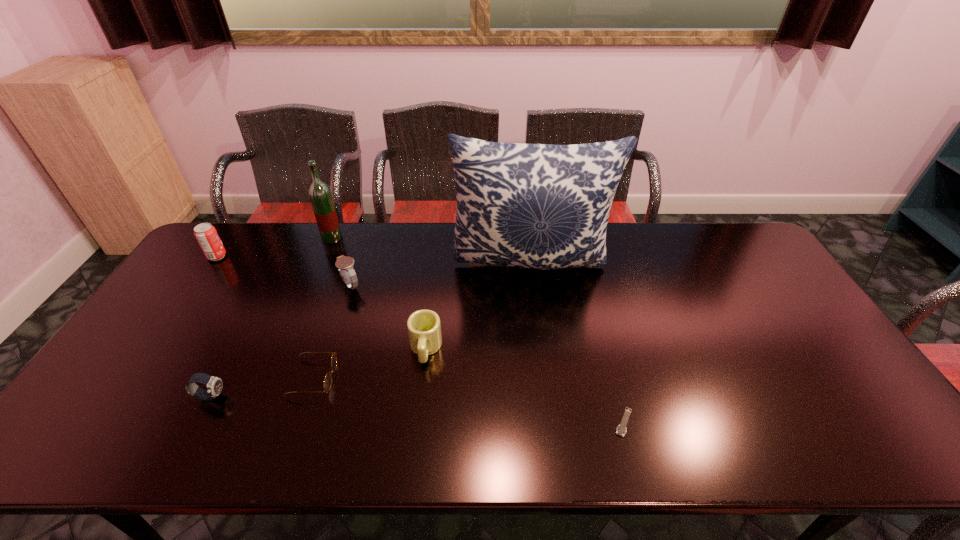
Where is `the tallest object`? This screenshot has width=960, height=540. the tallest object is located at coordinates (540, 206).

Identify the location of the seventh shortest object. (319, 192).

Locate an element on the screen. This screenshot has height=540, width=960. the third object from left to right is located at coordinates [x=319, y=192].

Image resolution: width=960 pixels, height=540 pixels. Find the location of `soda can`. soda can is located at coordinates (206, 234).

Find the location of `the sixth shortest object`. the sixth shortest object is located at coordinates (206, 234).

Identify the location of the farthest watch. The width and height of the screenshot is (960, 540). (345, 264).

Where is `the tallest watch`? This screenshot has height=540, width=960. the tallest watch is located at coordinates (345, 264).

The width and height of the screenshot is (960, 540). In order to click on the sixth object from left to right in this screenshot , I will do `click(424, 329)`.

Find the location of a particular element. the seventh object from right to left is located at coordinates (214, 385).

Locate an element on the screen. the second nearest watch is located at coordinates (214, 385).